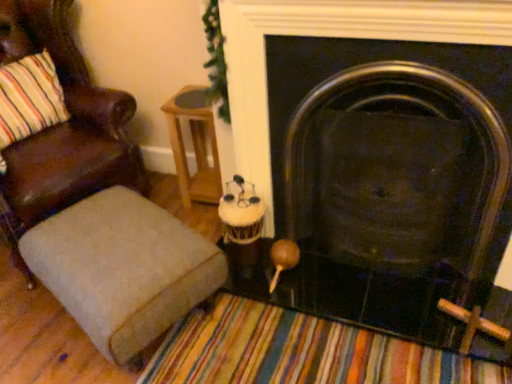
Question: From the image's perspective, is brown leather chair at left located above textured beige ottoman at lower left?

Choices:
 (A) yes
 (B) no

Answer: (A)

Question: From a real-world perspective, is brown leather chair at left beneath textured beige ottoman at lower left?

Choices:
 (A) no
 (B) yes

Answer: (A)

Question: Are brown leather chair at left and textured beige ottoman at lower left located far from each other?

Choices:
 (A) yes
 (B) no

Answer: (B)

Question: Considering the relative sizes of brown leather chair at left and textured beige ottoman at lower left in the image provided, is brown leather chair at left wider than textured beige ottoman at lower left?

Choices:
 (A) yes
 (B) no

Answer: (A)

Question: Can you confirm if brown leather chair at left is thinner than textured beige ottoman at lower left?

Choices:
 (A) no
 (B) yes

Answer: (A)

Question: Is black metal fireplace at center taller or shorter than woodenside table at center?

Choices:
 (A) short
 (B) tall

Answer: (B)

Question: From a real-world perspective, is black metal fireplace at center above or below woodenside table at center?

Choices:
 (A) above
 (B) below

Answer: (A)

Question: From the image's perspective, is black metal fireplace at center positioned above or below woodenside table at center?

Choices:
 (A) below
 (B) above

Answer: (A)

Question: Considering the positions of black metal fireplace at center and woodenside table at center in the image, is black metal fireplace at center wider or thinner than woodenside table at center?

Choices:
 (A) wide
 (B) thin

Answer: (B)

Question: Considering the positions of textured beige ottoman at lower left and woodenside table at center in the image, is textured beige ottoman at lower left taller or shorter than woodenside table at center?

Choices:
 (A) tall
 (B) short

Answer: (B)

Question: From the image's perspective, is textured beige ottoman at lower left located above or below woodenside table at center?

Choices:
 (A) above
 (B) below

Answer: (B)

Question: From a real-world perspective, is textured beige ottoman at lower left positioned above or below woodenside table at center?

Choices:
 (A) below
 (B) above

Answer: (A)

Question: Is textured beige ottoman at lower left in front of or behind woodenside table at center in the image?

Choices:
 (A) behind
 (B) front

Answer: (B)

Question: From a real-world perspective, is brown leather chair at left above or below black metal fireplace at center?

Choices:
 (A) below
 (B) above

Answer: (B)

Question: Choose the correct answer: Is brown leather chair at left inside black metal fireplace at center or outside it?

Choices:
 (A) outside
 (B) inside

Answer: (A)